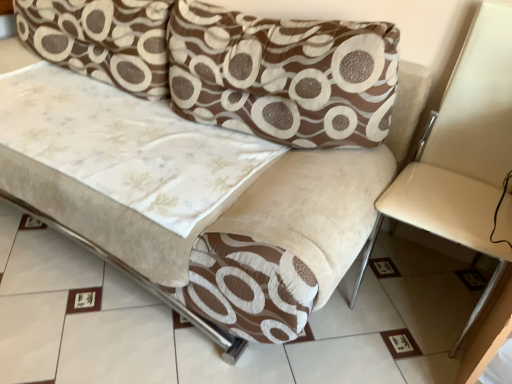
Question: Is brown textured pillow at upper center, which is counted as the 1th pillow, starting from the right, located outside brown textured pillow at upper left, the 2th pillow when ordered from right to left?

Choices:
 (A) yes
 (B) no

Answer: (A)

Question: From a real-world perspective, is brown textured pillow at upper center, which is the second pillow in left-to-right order, positioned over brown textured pillow at upper left, arranged as the first pillow when viewed from the left, based on gravity?

Choices:
 (A) no
 (B) yes

Answer: (B)

Question: Is the position of brown textured pillow at upper center, which is the second pillow in left-to-right order, more distant than that of brown textured pillow at upper left, arranged as the first pillow when viewed from the left?

Choices:
 (A) yes
 (B) no

Answer: (B)

Question: Does brown textured pillow at upper center, which is counted as the 1th pillow, starting from the right, have a greater height compared to brown textured pillow at upper left, the 2th pillow when ordered from right to left?

Choices:
 (A) yes
 (B) no

Answer: (A)

Question: Is brown textured pillow at upper center, which is counted as the 1th pillow, starting from the right, positioned with its back to brown textured pillow at upper left, arranged as the first pillow when viewed from the left?

Choices:
 (A) no
 (B) yes

Answer: (A)

Question: Does point click(432, 225) appear closer or farther from the camera than point click(272, 125)?

Choices:
 (A) farther
 (B) closer

Answer: (B)

Question: In the image, is beige fabric armchair at right positioned in front of or behind brown textured pillow at upper center, which is the second pillow in left-to-right order?

Choices:
 (A) behind
 (B) front

Answer: (B)

Question: In terms of width, does beige fabric armchair at right look wider or thinner when compared to brown textured pillow at upper center, which is counted as the 1th pillow, starting from the right?

Choices:
 (A) wide
 (B) thin

Answer: (A)

Question: From a real-world perspective, is beige fabric armchair at right positioned above or below brown textured pillow at upper center, which is the second pillow in left-to-right order?

Choices:
 (A) below
 (B) above

Answer: (A)

Question: Is brown textured pillow at upper center, which is counted as the 1th pillow, starting from the right, taller or shorter than brown textured pillow at upper left, arranged as the first pillow when viewed from the left?

Choices:
 (A) tall
 (B) short

Answer: (A)

Question: Is brown textured pillow at upper center, which is counted as the 1th pillow, starting from the right, wider or thinner than brown textured pillow at upper left, the 2th pillow when ordered from right to left?

Choices:
 (A) wide
 (B) thin

Answer: (A)

Question: Looking at the image, does brown textured pillow at upper center, which is the second pillow in left-to-right order, seem bigger or smaller compared to brown textured pillow at upper left, arranged as the first pillow when viewed from the left?

Choices:
 (A) small
 (B) big

Answer: (B)

Question: Is brown textured pillow at upper center, which is counted as the 1th pillow, starting from the right, inside or outside of brown textured pillow at upper left, the 2th pillow when ordered from right to left?

Choices:
 (A) inside
 (B) outside

Answer: (B)

Question: Considering the positions of brown textured pillow at upper left, the 2th pillow when ordered from right to left, and brown textured pillow at upper center, which is the second pillow in left-to-right order, in the image, is brown textured pillow at upper left, the 2th pillow when ordered from right to left, bigger or smaller than brown textured pillow at upper center, which is the second pillow in left-to-right order,?

Choices:
 (A) small
 (B) big

Answer: (A)

Question: Is brown textured pillow at upper left, the 2th pillow when ordered from right to left, wider or thinner than brown textured pillow at upper center, which is counted as the 1th pillow, starting from the right?

Choices:
 (A) wide
 (B) thin

Answer: (B)